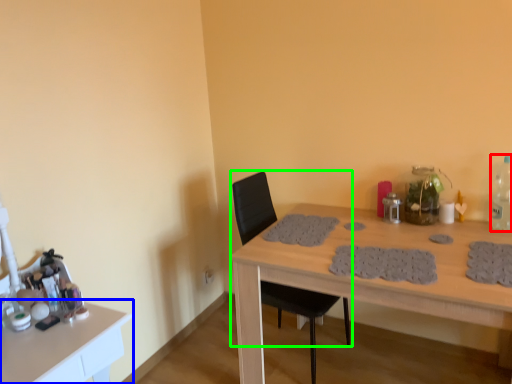
Question: Which object is the farthest from bottle (highlighted by a red box)? Choose among these: table (highlighted by a blue box) or chair (highlighted by a green box).

Choices:
 (A) table
 (B) chair

Answer: (A)